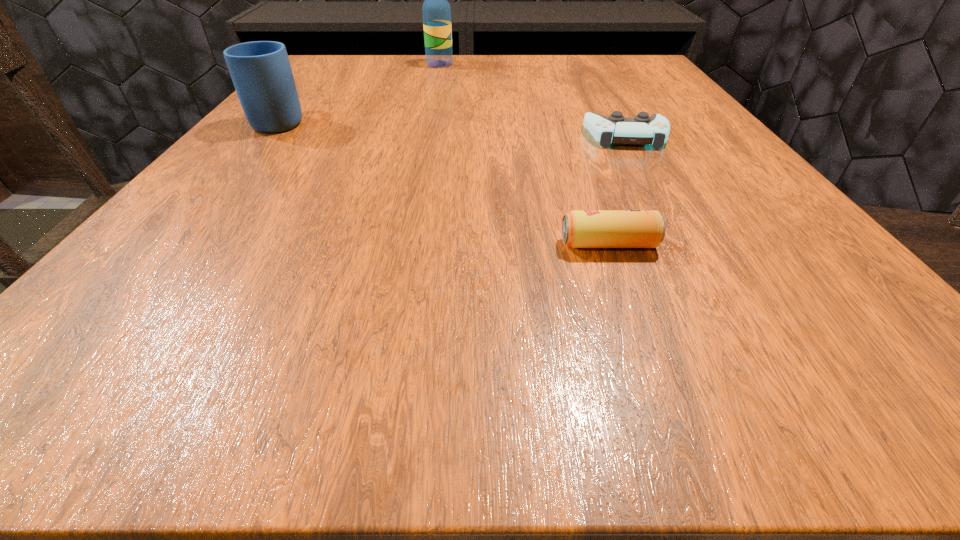
You are a GUI agent. You are given a task and a screenshot of the screen. Output one action in this format:
    pyautogui.click(x=<x>, y=<y>)
    Task: Click on the free space at the near right corner of the desktop
    The width and height of the screenshot is (960, 540).
    Given the screenshot: What is the action you would take?
    pyautogui.click(x=789, y=359)

I want to click on empty space between the leftmost object and the beer can, so click(x=444, y=182).

The height and width of the screenshot is (540, 960). I want to click on empty space that is in between the farthest object and the third shortest object, so click(x=360, y=92).

Find the location of a particular element. free point between the nearest object and the leftmost object is located at coordinates (444, 182).

Locate an element on the screen. vacant point located between the leftmost object and the nearest object is located at coordinates (444, 182).

Locate an element on the screen. This screenshot has width=960, height=540. blank region between the mug and the nearest object is located at coordinates (444, 182).

The image size is (960, 540). I want to click on free spot between the third shortest object and the beer can, so click(444, 182).

Identify the location of free spot between the control and the beer can. The width and height of the screenshot is (960, 540). (617, 190).

I want to click on vacant area between the control and the nearest object, so click(x=617, y=190).

The height and width of the screenshot is (540, 960). In order to click on vacant space in between the nearest object and the control in this screenshot , I will do `click(617, 190)`.